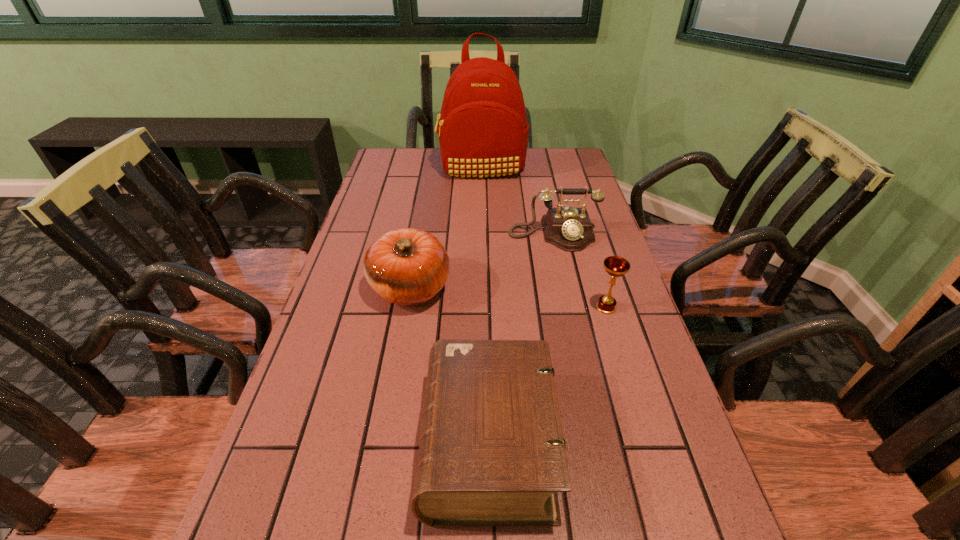
In order to click on the farthest object in this screenshot , I will do `click(483, 131)`.

At what (x,y) coordinates should I click in order to perform the action: click on the tallest object. Please return your answer as a coordinate pair (x, y). Looking at the image, I should click on (483, 131).

The width and height of the screenshot is (960, 540). Identify the location of pumpkin. (407, 266).

This screenshot has width=960, height=540. I want to click on the fourth nearest object, so click(x=569, y=229).

The height and width of the screenshot is (540, 960). I want to click on chalice, so click(616, 266).

Where is `the nearest object`? The image size is (960, 540). the nearest object is located at coordinates (492, 452).

Find the location of a particular element. vacant space located 0.150m on the front-facing side of the tallest object is located at coordinates (482, 206).

Where is `blank space located 0.050m on the left of the pumpkin`? blank space located 0.050m on the left of the pumpkin is located at coordinates (348, 288).

The width and height of the screenshot is (960, 540). In order to click on vacant position located 0.380m on the dial of the telephone in this screenshot , I will do `click(582, 366)`.

At what (x,y) coordinates should I click in order to perform the action: click on free region located on the front of the chalice. Please return your answer as a coordinate pair (x, y). The width and height of the screenshot is (960, 540). Looking at the image, I should click on (625, 369).